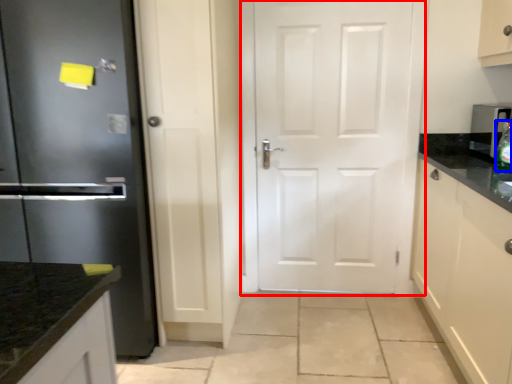
Question: Which of the following is the closest to the observer, door (highlighted by a red box) or bottle (highlighted by a blue box)?

Choices:
 (A) door
 (B) bottle

Answer: (B)